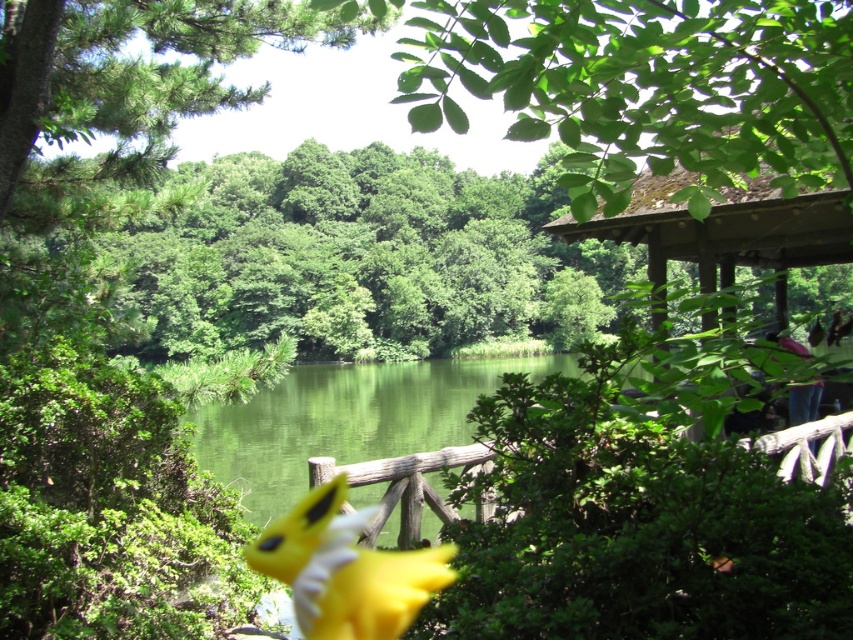
You are standing in the serene outdoor scene and want to take a photo of the green leafy tree at upper left. Since the wooden gazebo on the right is blocking your view, can you move to the left to get a clear shot?

The green leafy tree at upper left is located at point (132, 67), which means it is positioned near the upper left corner of the frame. Moving to the left might not be necessary as the tree is already at the upper left, but the wooden gazebo on the right is not blocking its view since they are on opposite sides. You can take the photo without moving.

You are planning to place a new bench in the garden. The bench is 1.2 meters tall. You see the green leafy tree at upper left and the yellow plush toy at center. Which object is taller than the bench?

The green leafy tree at upper left is taller than the yellow plush toy at center, so the green leafy tree at upper left is taller than the bench.

You are planning to place a new bench in the scene so that it can be seen from both the yellow plush toy at center and the green leafy tree at upper left. Based on their sizes, which object should the bench be closer to?

The bench should be placed closer to the yellow plush toy at center because the green leafy tree at upper left is wider, so positioning the bench closer to the smaller yellow plush toy at center ensures visibility from both locations.